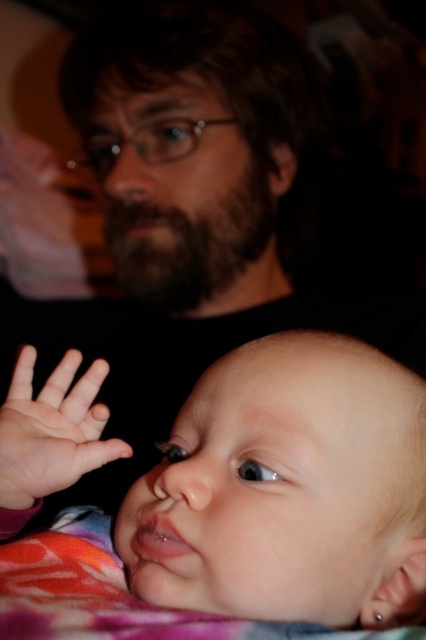
Question: Which point appears closest to the camera in this image?

Choices:
 (A) (245, 440)
 (B) (78, 460)
 (C) (85, 621)

Answer: (C)

Question: Which of the following is the closest to the observer?

Choices:
 (A) fluffy pink blanket at lower left
 (B) smooth skin baby at lower left

Answer: (A)

Question: Considering the relative positions of smooth skin baby at lower left and pink smooth skin at lower left in the image provided, where is smooth skin baby at lower left located with respect to pink smooth skin at lower left?

Choices:
 (A) left
 (B) right

Answer: (B)

Question: Based on their relative distances, which object is farther from the pink smooth skin at lower left?

Choices:
 (A) fluffy pink blanket at lower left
 (B) smooth skin baby at lower left

Answer: (A)

Question: Is smooth skin baby at lower left to the left of fluffy pink blanket at lower left from the viewer's perspective?

Choices:
 (A) no
 (B) yes

Answer: (A)

Question: In this image, where is fluffy pink blanket at lower left located relative to pink smooth skin at lower left?

Choices:
 (A) above
 (B) below

Answer: (B)